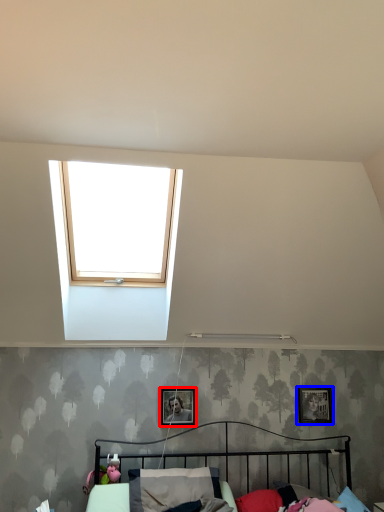
Question: Among these objects, which one is nearest to the camera, picture frame (highlighted by a red box) or picture frame (highlighted by a blue box)?

Choices:
 (A) picture frame
 (B) picture frame

Answer: (A)